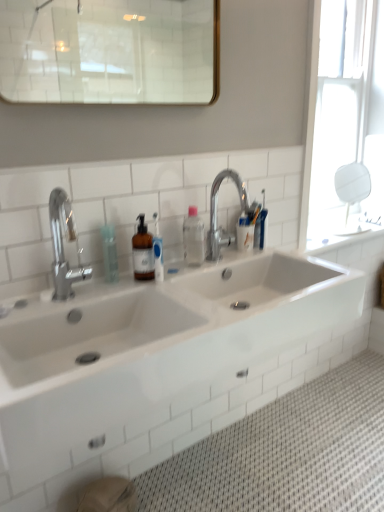
Locate an element on the screen. The width and height of the screenshot is (384, 512). free area below silver metallic faucet at upper center, which ranks as the 1th tap in back-to-front order (from a real-world perspective) is located at coordinates (242, 254).